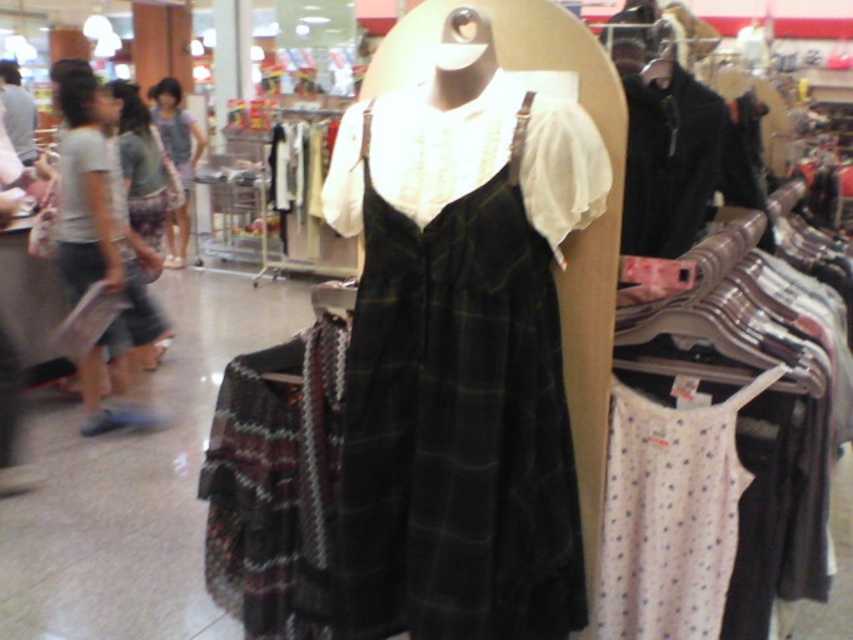
Question: Based on their relative distances, which object is nearer to the dark green plaid dress at center?

Choices:
 (A) matte purple scarf at center
 (B) matte gray shirt at left
 (C) gray cotton pants at left

Answer: (C)

Question: Which object is positioned closest to the plaid fabric dress at center?

Choices:
 (A) black wool coat at upper right
 (B) matte purple scarf at center
 (C) matte gray dress at center

Answer: (C)

Question: Can you confirm if matte green dress at left is positioned above plaid fabric dress at center?

Choices:
 (A) yes
 (B) no

Answer: (B)

Question: Does gray cotton pants at left have a lesser width compared to matte purple scarf at center?

Choices:
 (A) yes
 (B) no

Answer: (B)

Question: Which object appears closest to the camera in this image?

Choices:
 (A) dark green plaid dress at center
 (B) matte green dress at left
 (C) matte gray shirt at left
 (D) white dotted fabric at lower right

Answer: (A)

Question: Is black wool coat at upper right behind plaid fabric dress at center?

Choices:
 (A) yes
 (B) no

Answer: (B)